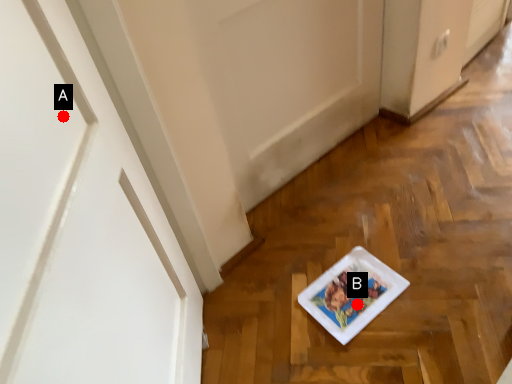
Question: Two points are circled on the image, labeled by A and B beside each circle. Which point is farther from the camera taking this photo?

Choices:
 (A) A is further
 (B) B is further

Answer: (B)